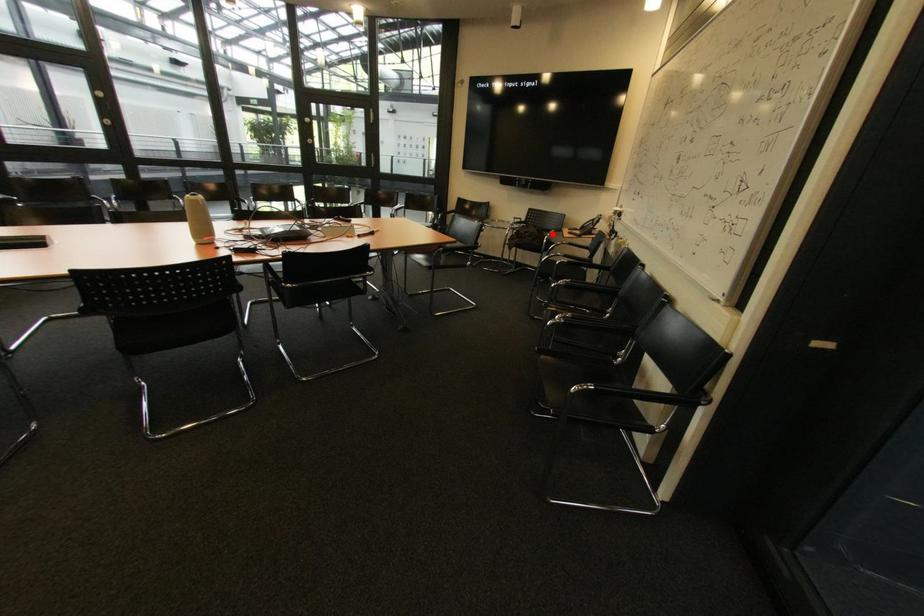
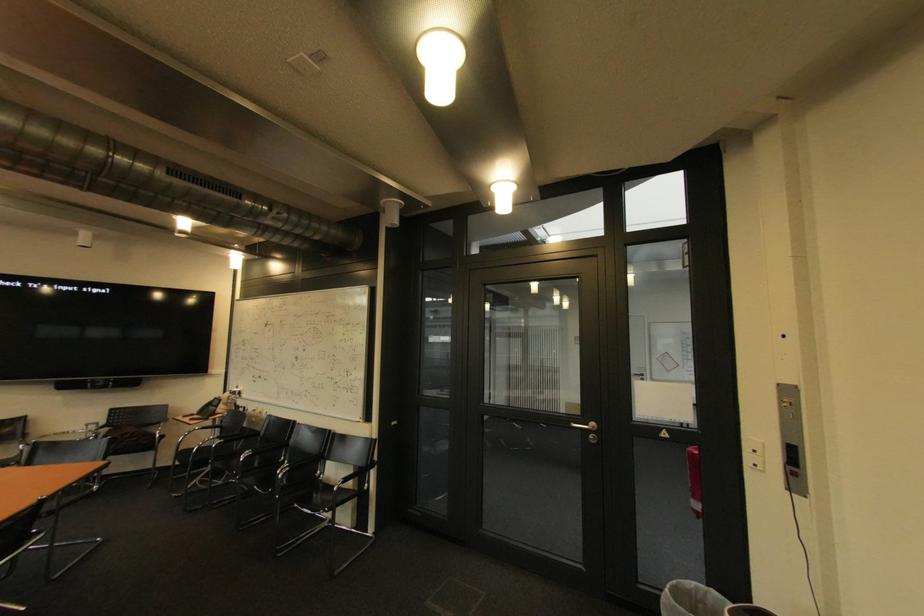
Question: I am providing you with two images of the same scene from different viewpoints. Given a red point in image1, look at the same physical point in image2. Is it:

Choices:
 (A) Closer to the viewpoint
 (B) Farther from the viewpoint

Answer: (B)